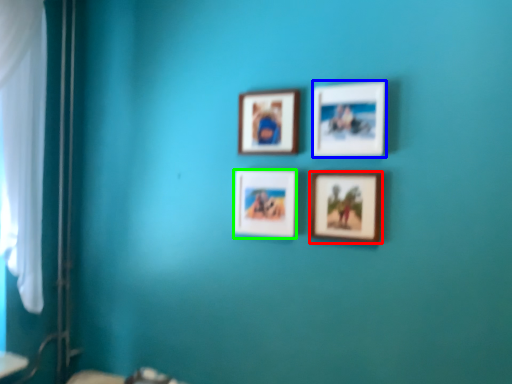
Question: Which object is positioned farthest from picture frame (highlighted by a red box)? Select from picture frame (highlighted by a blue box) and picture frame (highlighted by a green box).

Choices:
 (A) picture frame
 (B) picture frame

Answer: (B)